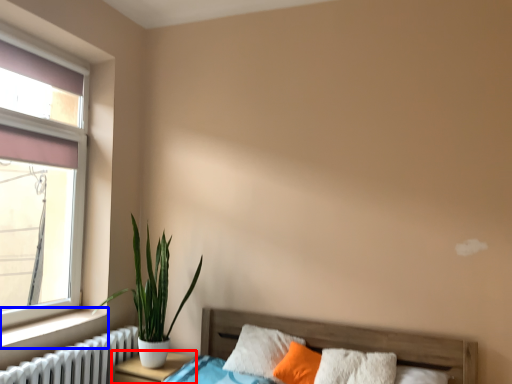
Question: Among these objects, which one is farthest to the camera, nightstand (highlighted by a red box) or window sill (highlighted by a blue box)?

Choices:
 (A) nightstand
 (B) window sill

Answer: (A)